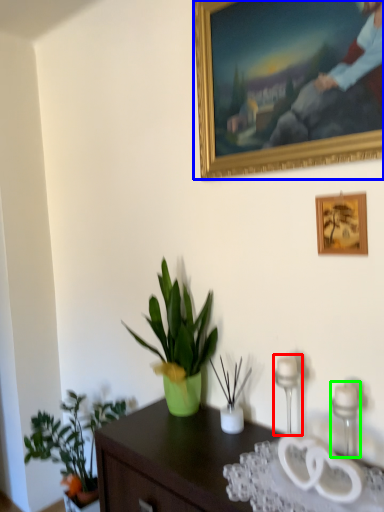
Question: Considering the real-world distances, which object is farthest from candle holder (highlighted by a red box)? picture frame (highlighted by a blue box) or candle holder (highlighted by a green box)?

Choices:
 (A) picture frame
 (B) candle holder

Answer: (A)